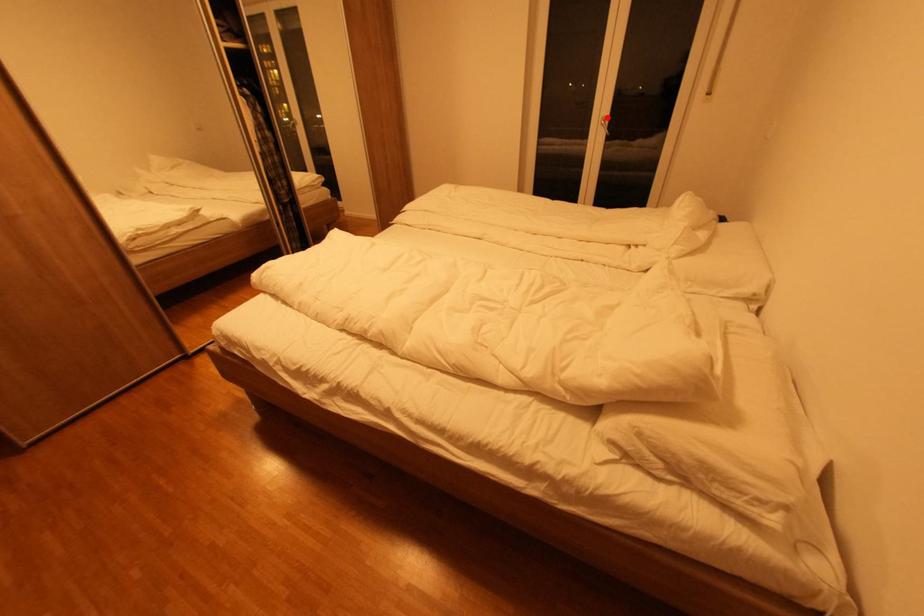
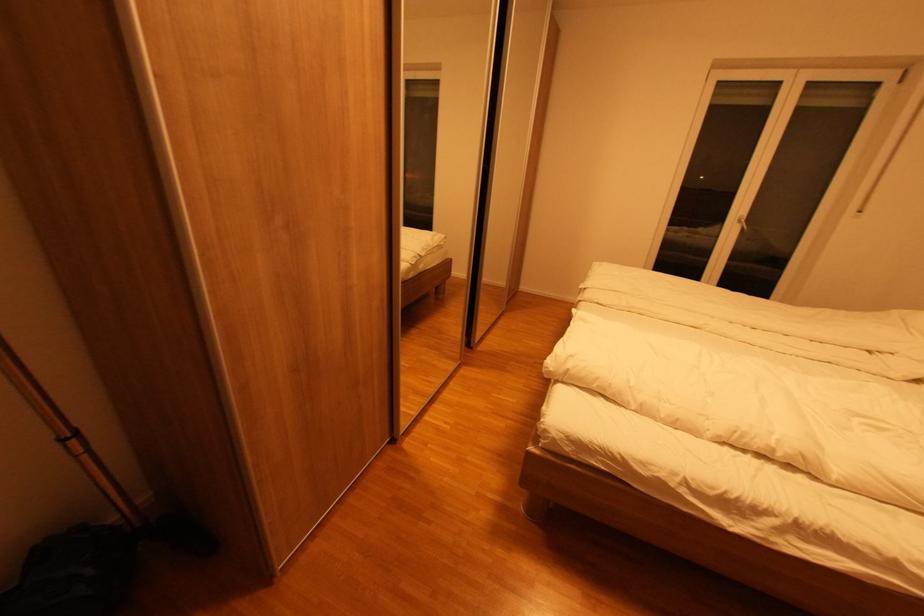
Locate, in the second image, the point that corresponds to the highlighted location in the first image.

(744, 216)